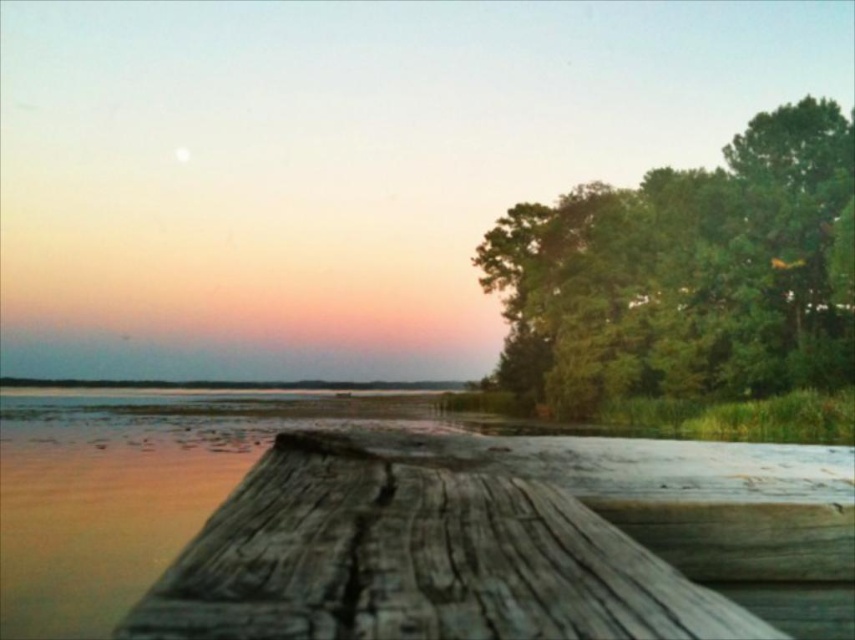
Question: Is weathered wood dock at center thinner than green leafy tree at upper right?

Choices:
 (A) no
 (B) yes

Answer: (B)

Question: Is weathered wood dock at center closer to camera compared to green leafy tree at upper right?

Choices:
 (A) yes
 (B) no

Answer: (A)

Question: In this image, where is weathered wood dock at center located relative to green leafy tree at upper right?

Choices:
 (A) left
 (B) right

Answer: (A)

Question: Among these objects, which one is farthest from the camera?

Choices:
 (A) green leafy tree at upper right
 (B) weathered wood dock at center

Answer: (A)